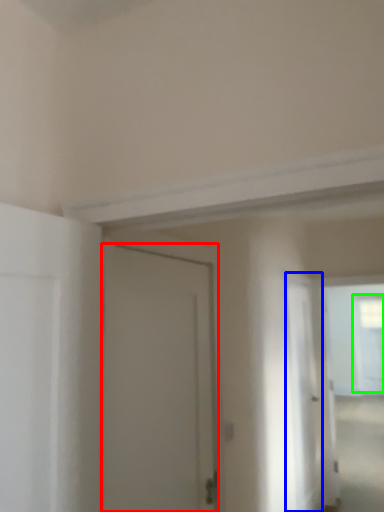
Question: Considering the real-world distances, which object is farthest from door (highlighted by a red box)? screen door (highlighted by a blue box) or window (highlighted by a green box)?

Choices:
 (A) screen door
 (B) window

Answer: (B)